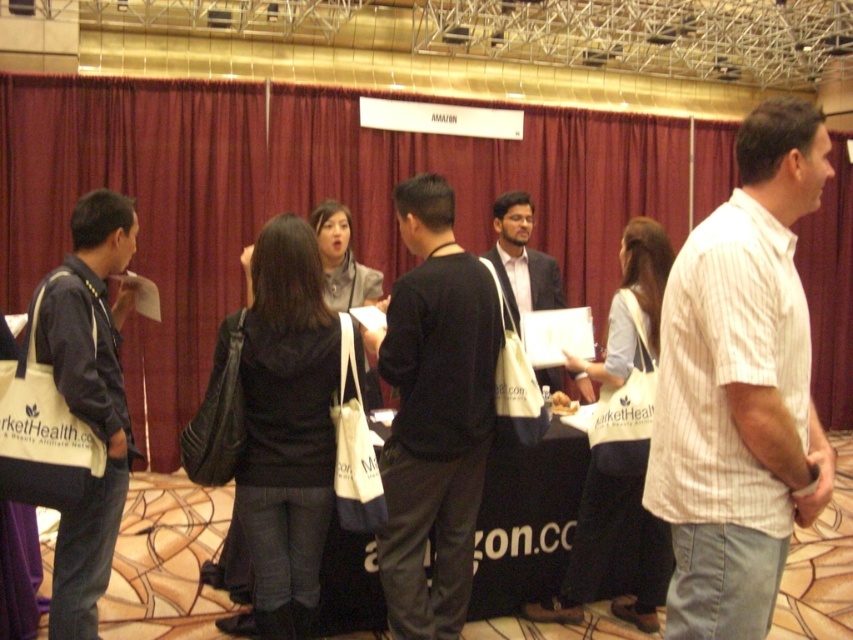
Question: Does white striped shirt at right have a larger size compared to matte black jacket at left?

Choices:
 (A) no
 (B) yes

Answer: (B)

Question: Which object is farther from the camera taking this photo?

Choices:
 (A) white striped shirt at right
 (B) black matte shirt at center
 (C) matte black jacket at left
 (D) dark blue suit at center

Answer: (D)

Question: From the image, what is the correct spatial relationship of white striped shirt at right in relation to dark blue suit at center?

Choices:
 (A) above
 (B) below

Answer: (B)

Question: Where is white striped shirt at right located in relation to matte black jacket at left in the image?

Choices:
 (A) below
 (B) above

Answer: (B)

Question: Among these objects, which one is nearest to the camera?

Choices:
 (A) matte black jacket at left
 (B) dark blue suit at center
 (C) white striped shirt at right
 (D) black matte shirt at center

Answer: (C)

Question: Estimate the real-world distances between objects in this image. Which object is farther from the white striped shirt at right?

Choices:
 (A) matte black jacket at left
 (B) black matte shirt at center

Answer: (A)